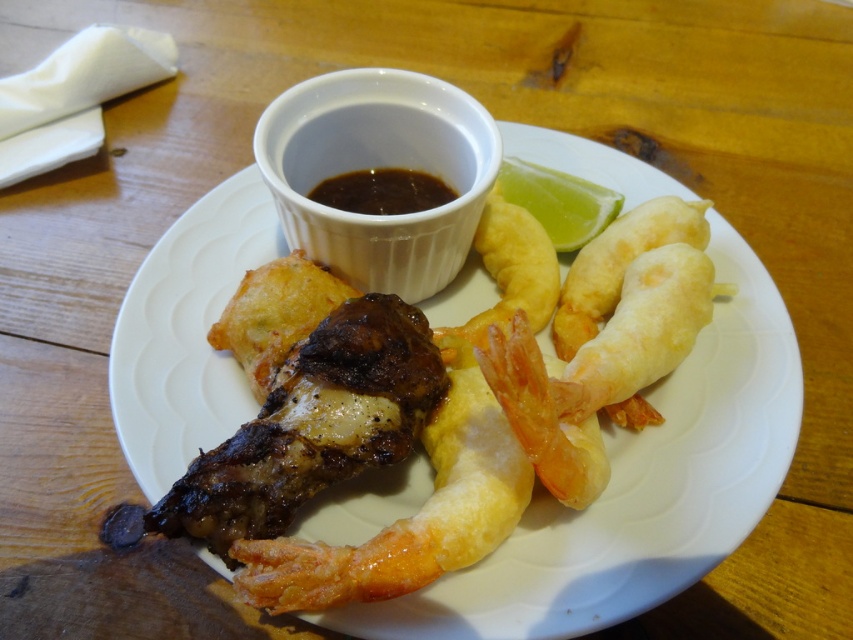
You are a food critic who wants to dip the golden fried shrimp at center into the dark glossy sauce at center. Based on their positions, which one is easier to reach without moving your hand?

The golden fried shrimp at center is closer to the viewer than the dark glossy sauce at center, so it is easier to reach without moving your hand.

You are a food critic who wants to describe the height of the golden fried shrimp at center and the dark glossy sauce at center in the dish. Which one is taller?

The golden fried shrimp at center is much taller than the dark glossy sauce at center.

You are a food critic who wants to describe the golden fried shrimp at center in the image. What is the location of the golden fried shrimp at center relative to the point at coordinates (x=503, y=419)?

The point at coordinates (x=503, y=419) is located on the golden fried shrimp at center, so the golden fried shrimp at center is exactly at that point.